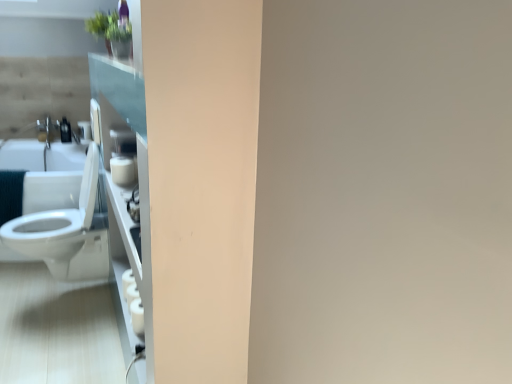
Question: Is white glossy toilet at left wider than matte white soap dispenser at left?

Choices:
 (A) no
 (B) yes

Answer: (B)

Question: Considering the relative positions of white glossy toilet at left and matte white soap dispenser at left in the image provided, is white glossy toilet at left behind matte white soap dispenser at left?

Choices:
 (A) no
 (B) yes

Answer: (A)

Question: Is white glossy toilet at left with matte white soap dispenser at left?

Choices:
 (A) yes
 (B) no

Answer: (B)

Question: Is white glossy toilet at left closer to the viewer compared to matte white soap dispenser at left?

Choices:
 (A) no
 (B) yes

Answer: (B)

Question: Is matte white soap dispenser at left at the back of white glossy toilet at left?

Choices:
 (A) yes
 (B) no

Answer: (B)

Question: Is matte white soap dispenser at left spatially inside white glossy sink at left, or outside of it?

Choices:
 (A) inside
 (B) outside

Answer: (A)

Question: In the image, is matte white soap dispenser at left on the left side or the right side of white glossy sink at left?

Choices:
 (A) right
 (B) left

Answer: (A)

Question: From a real-world perspective, is matte white soap dispenser at left positioned above or below white glossy sink at left?

Choices:
 (A) below
 (B) above

Answer: (B)

Question: From the image's perspective, is matte white soap dispenser at left located above or below white glossy sink at left?

Choices:
 (A) below
 (B) above

Answer: (B)

Question: Considering the positions of matte white soap dispenser at left and white glossy toilet at left in the image, is matte white soap dispenser at left wider or thinner than white glossy toilet at left?

Choices:
 (A) wide
 (B) thin

Answer: (B)

Question: In the image, is matte white soap dispenser at left on the left side or the right side of white glossy toilet at left?

Choices:
 (A) left
 (B) right

Answer: (A)

Question: Is matte white soap dispenser at left spatially inside white glossy toilet at left, or outside of it?

Choices:
 (A) outside
 (B) inside

Answer: (A)

Question: From the image's perspective, relative to white glossy toilet at left, is matte white soap dispenser at left above or below?

Choices:
 (A) below
 (B) above

Answer: (B)

Question: Considering the relative positions of white glossy toilet at left and white glossy sink at left in the image provided, is white glossy toilet at left to the left or to the right of white glossy sink at left?

Choices:
 (A) right
 (B) left

Answer: (A)

Question: Considering the positions of white glossy toilet at left and white glossy sink at left in the image, is white glossy toilet at left taller or shorter than white glossy sink at left?

Choices:
 (A) short
 (B) tall

Answer: (B)